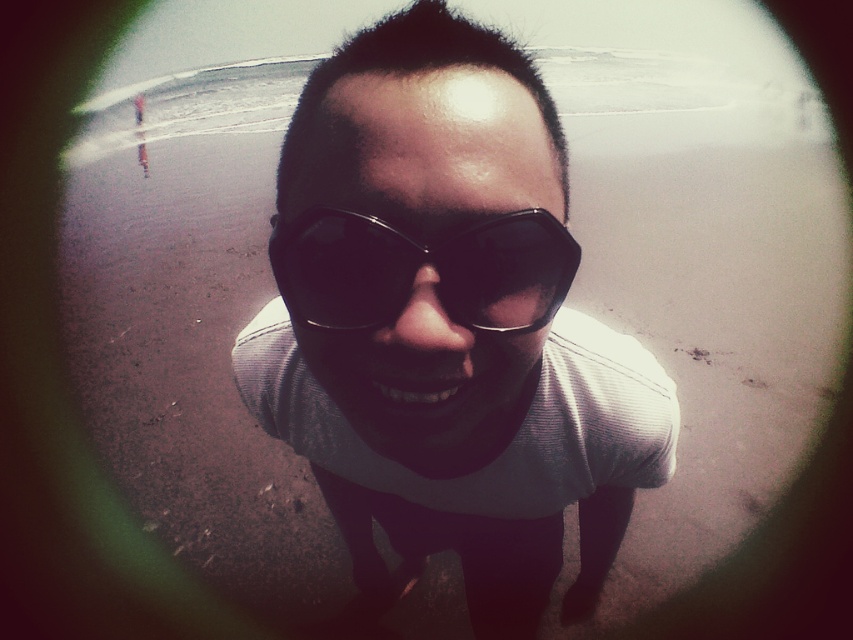
Question: Can you confirm if matte black sunglasses at center is bigger than black plastic goggles at center?

Choices:
 (A) no
 (B) yes

Answer: (B)

Question: Is matte black sunglasses at center to the right of black plastic goggles at center from the viewer's perspective?

Choices:
 (A) yes
 (B) no

Answer: (A)

Question: Is matte black sunglasses at center further to camera compared to black plastic goggles at center?

Choices:
 (A) no
 (B) yes

Answer: (B)

Question: Which point appears closest to the camera in this image?

Choices:
 (A) [527, 280]
 (B) [663, 413]

Answer: (A)

Question: Which point appears closest to the camera in this image?

Choices:
 (A) 497,108
 (B) 329,280

Answer: (A)